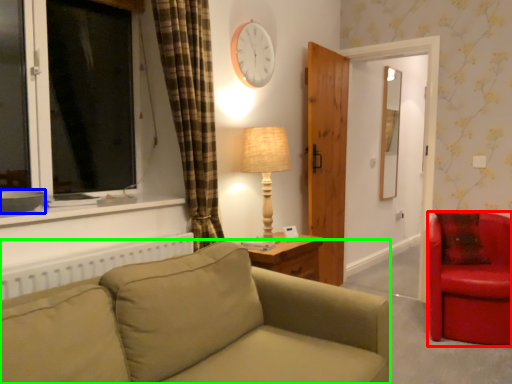
Question: Considering the real-world distances, which object is farthest from chair (highlighted by a red box)? bowl (highlighted by a blue box) or studio couch (highlighted by a green box)?

Choices:
 (A) bowl
 (B) studio couch

Answer: (A)